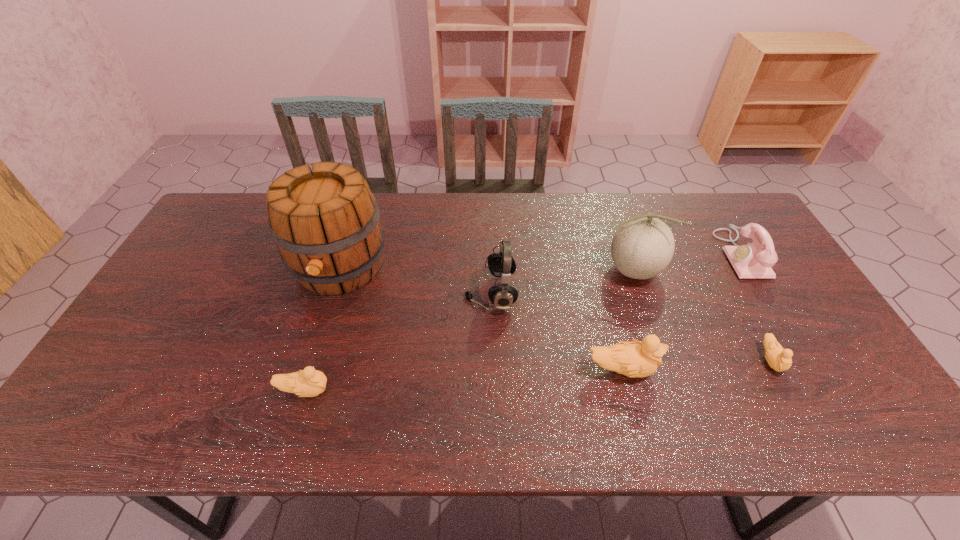
Where is `vacant area that lies between the rightmost object and the headset`? Image resolution: width=960 pixels, height=540 pixels. vacant area that lies between the rightmost object and the headset is located at coordinates (615, 274).

Where is `object that is the third closest one to the cider`? object that is the third closest one to the cider is located at coordinates (x=633, y=359).

You are a GUI agent. You are given a task and a screenshot of the screen. Output one action in this format:
    pyautogui.click(x=<x>, y=<y>)
    Task: Click on the object that can be found as the fifth closest to the rightmost object
    The height and width of the screenshot is (540, 960).
    Given the screenshot: What is the action you would take?
    pyautogui.click(x=325, y=221)

Where is `duckling that is the second closest to the second duckling from left to right`? The image size is (960, 540). duckling that is the second closest to the second duckling from left to right is located at coordinates (309, 382).

Identify which duckling is located as the third nearest to the third object from left to right. Please provide its 2D coordinates. Your answer should be formatted as a tuple, i.e. [(x, y)], where the tuple contains the x and y coordinates of a point satisfying the conditions above.

[(778, 358)]

The height and width of the screenshot is (540, 960). I want to click on vacant area in the image that satisfies the following two spatial constraints: 1. on the face of the shortest duckling; 2. on the face of the second duckling from left to right, so click(x=776, y=369).